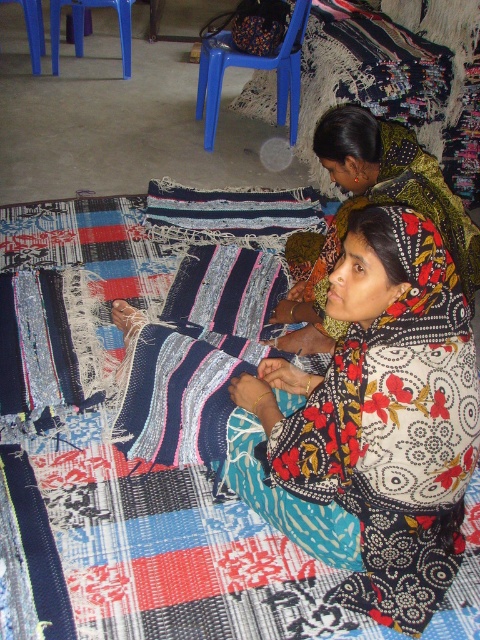
Question: Among these objects, which one is farthest from the camera?

Choices:
 (A) blue plastic stool at upper left
 (B) floral-patterned fabric at center

Answer: (A)

Question: Can you confirm if floral-patterned fabric at center is positioned below blue plastic stool at upper left?

Choices:
 (A) no
 (B) yes

Answer: (B)

Question: Estimate the real-world distances between objects in this image. Which object is farther from the floral fabric at center?

Choices:
 (A) blue plastic stool at upper left
 (B) floral-patterned fabric at center

Answer: (A)

Question: Does floral fabric at center have a smaller size compared to blue plastic stool at upper left?

Choices:
 (A) no
 (B) yes

Answer: (A)

Question: Which point is closer to the camera?

Choices:
 (A) floral-patterned fabric at center
 (B) blue plastic stool at upper left

Answer: (A)

Question: In this image, where is floral fabric at center located relative to floral-patterned fabric at center?

Choices:
 (A) right
 (B) left

Answer: (B)